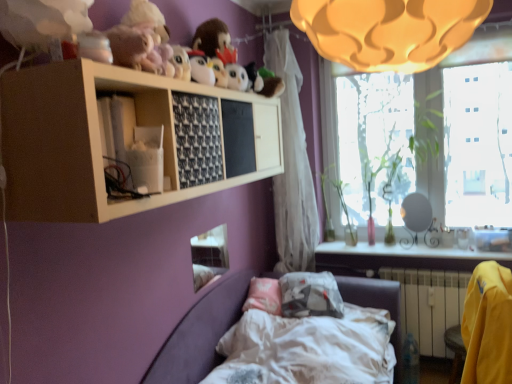
Measure the distance between point (443, 347) and camera.

The distance of point (443, 347) from camera is 2.79 meters.

Measure the distance between white plush toy at upper center and camera.

The distance of white plush toy at upper center from camera is 5.41 feet.

Describe the element at coordinates (319, 337) in the screenshot. The width and height of the screenshot is (512, 384). I see `velvet purple bed at lower center` at that location.

What do you see at coordinates (126, 139) in the screenshot? This screenshot has width=512, height=384. I see `white matte shelf at upper center` at bounding box center [126, 139].

Describe the element at coordinates (388, 30) in the screenshot. I see `matte yellow lampshade at upper center` at that location.

Measure the distance between point (430, 15) and camera.

They are 1.00 meters apart.

Where is `yellow fabric chair at lower right`? The image size is (512, 384). yellow fabric chair at lower right is located at coordinates (455, 350).

Measure the distance between point (451, 348) and camera.

Point (451, 348) is 2.62 meters from camera.

Where is `yellow fabric armchair at lower right`? The image size is (512, 384). yellow fabric armchair at lower right is located at coordinates (488, 325).

This screenshot has width=512, height=384. Describe the element at coordinates (488, 325) in the screenshot. I see `yellow fabric armchair at lower right` at that location.

This screenshot has width=512, height=384. What are the coordinates of `white plastic radiator at lower right` in the screenshot? It's located at (429, 305).

Is yellow fabric armchair at lower right bigger than white sheer curtain at center?

Incorrect, yellow fabric armchair at lower right is not larger than white sheer curtain at center.

Is yellow fabric armchair at lower right situated inside white sheer curtain at center or outside?

yellow fabric armchair at lower right is located beyond the bounds of white sheer curtain at center.

From the image's perspective, which object appears higher, yellow fabric armchair at lower right or white sheer curtain at center?

white sheer curtain at center, from the image's perspective.

Is yellow fabric armchair at lower right turned away from white sheer curtain at center?

No.

Looking at this image, does matte yellow lampshade at upper center have a greater height compared to white plastic radiator at lower right?

No.

In the scene shown: How many degrees apart are the facing directions of matte yellow lampshade at upper center and white plastic radiator at lower right?

1.24 degrees separate the facing orientations of matte yellow lampshade at upper center and white plastic radiator at lower right.

Would you say white plastic radiator at lower right is part of matte yellow lampshade at upper center's contents?

No, white plastic radiator at lower right is not a part of matte yellow lampshade at upper center.

Would you consider matte yellow lampshade at upper center to be distant from white plastic radiator at lower right?

Yes, matte yellow lampshade at upper center is far from white plastic radiator at lower right.

Is the depth of translucent glass window at upper right greater than that of yellow fabric chair at lower right?

That is True.

Looking at this image, from the image's perspective, does translucent glass window at upper right appear lower than yellow fabric chair at lower right?

No, from the image's perspective, translucent glass window at upper right is not beneath yellow fabric chair at lower right.

Considering the sizes of objects translucent glass window at upper right and yellow fabric chair at lower right in the image provided, who is thinner, translucent glass window at upper right or yellow fabric chair at lower right?

With smaller width is translucent glass window at upper right.

Considering the sizes of objects translucent glass window at upper right and yellow fabric chair at lower right in the image provided, who is smaller, translucent glass window at upper right or yellow fabric chair at lower right?

Smaller between the two is yellow fabric chair at lower right.

From the image's perspective, is white sheer curtain at center located above or below translucent glass window at upper right?

white sheer curtain at center is below translucent glass window at upper right.

Is translucent glass window at upper right a part of white sheer curtain at center?

No, white sheer curtain at center does not contain translucent glass window at upper right.

Looking at this image, which object is positioned more to the right, white sheer curtain at center or translucent glass window at upper right?

translucent glass window at upper right.

In the scene shown: Considering the relative sizes of white sheer curtain at center and translucent glass window at upper right in the image provided, is white sheer curtain at center shorter than translucent glass window at upper right?

No, white sheer curtain at center is not shorter than translucent glass window at upper right.

Where is `bed lying in front of the yellow fabric armchair at lower right`? Image resolution: width=512 pixels, height=384 pixels. bed lying in front of the yellow fabric armchair at lower right is located at coordinates (319, 337).

Is yellow fabric armchair at lower right wider than velvet purple bed at lower center?

No.

Is translucent glass window at upper right positioned far away from velvet purple bed at lower center?

Yes, translucent glass window at upper right is far from velvet purple bed at lower center.

How different are the orientations of translucent glass window at upper right and velvet purple bed at lower center in degrees?

The angle between the facing direction of translucent glass window at upper right and the facing direction of velvet purple bed at lower center is 0.623 degrees.

Can you confirm if translucent glass window at upper right is positioned to the right of velvet purple bed at lower center?

Yes, translucent glass window at upper right is to the right of velvet purple bed at lower center.

Who is shorter, translucent glass window at upper right or velvet purple bed at lower center?

velvet purple bed at lower center.

Considering the sizes of objects yellow fabric armchair at lower right and translucent glass window at upper right in the image provided, who is bigger, yellow fabric armchair at lower right or translucent glass window at upper right?

yellow fabric armchair at lower right.

Where is `window that is above the yellow fabric armchair at lower right (from a real-world perspective)`? The height and width of the screenshot is (384, 512). window that is above the yellow fabric armchair at lower right (from a real-world perspective) is located at coordinates (472, 54).

Who is shorter, yellow fabric armchair at lower right or translucent glass window at upper right?

Standing shorter between the two is yellow fabric armchair at lower right.

I want to click on armchair located on the right of white sheer curtain at center, so click(x=488, y=325).

Where is `radiator behind the matte yellow lampshade at upper center`? radiator behind the matte yellow lampshade at upper center is located at coordinates (429, 305).

Based on their spatial positions, is yellow fabric armchair at lower right or white sheer curtain at center further from yellow fabric chair at lower right?

Based on the image, white sheer curtain at center appears to be further to yellow fabric chair at lower right.

Looking at the image, which one is located further to translucent glass window at upper right, matte yellow lampshade at upper center or velvet purple bed at lower center?

matte yellow lampshade at upper center.

When comparing their distances from white plastic radiator at lower right, does velvet purple bed at lower center or yellow fabric armchair at lower right seem closer?

velvet purple bed at lower center is closer to white plastic radiator at lower right.

Consider the image. Estimate the real-world distances between objects in this image. Which object is further from translucent glass window at upper right, velvet purple bed at lower center or white plastic radiator at lower right?

velvet purple bed at lower center is further to translucent glass window at upper right.

When comparing their distances from yellow fabric chair at lower right, does translucent glass window at upper right or velvet purple bed at lower center seem further?

The object further to yellow fabric chair at lower right is translucent glass window at upper right.

Based on their spatial positions, is translucent glass window at upper right or white plush toy at upper center closer to velvet purple bed at lower center?

Among the two, white plush toy at upper center is located nearer to velvet purple bed at lower center.

Based on the photo, from the image, which object appears to be nearer to velvet purple bed at lower center, white plush toy at upper center or yellow fabric chair at lower right?

yellow fabric chair at lower right is positioned closer to the anchor velvet purple bed at lower center.

Consider the image. From the image, which object appears to be farther from white sheer curtain at center, white plush toy at upper center or velvet purple bed at lower center?

white plush toy at upper center is further to white sheer curtain at center.

Where is `armchair between velvet purple bed at lower center and yellow fabric chair at lower right in the horizontal direction`? The image size is (512, 384). armchair between velvet purple bed at lower center and yellow fabric chair at lower right in the horizontal direction is located at coordinates (488, 325).

The image size is (512, 384). What are the coordinates of `shelf between matte yellow lampshade at upper center and velvet purple bed at lower center vertically` in the screenshot? It's located at (126, 139).

This screenshot has width=512, height=384. What are the coordinates of `curtain located between white plush toy at upper center and translucent glass window at upper right in the left-right direction` in the screenshot? It's located at (292, 166).

Locate an element on the screen. The height and width of the screenshot is (384, 512). armchair located between white plush toy at upper center and white plastic radiator at lower right in the left-right direction is located at coordinates [x=488, y=325].